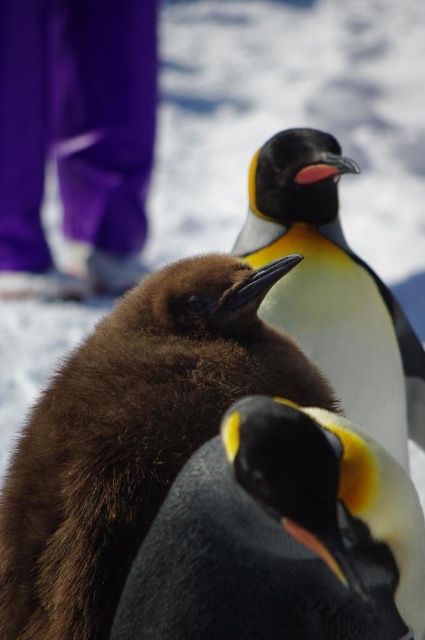
What do you see at coordinates (282, 538) in the screenshot?
I see `black matte penguin at center` at bounding box center [282, 538].

Which is more to the left, black matte penguin at center or black and white feathers at center?

From the viewer's perspective, black matte penguin at center appears more on the left side.

Who is more forward, (x=277, y=506) or (x=334, y=225)?

Point (x=277, y=506) is more forward.

What are the coordinates of `black matte penguin at center` in the screenshot? It's located at (282, 538).

Which is more to the left, brown fuzzy penguin at center or black matte penguin at center?

Positioned to the left is brown fuzzy penguin at center.

Find the location of a particular element. The height and width of the screenshot is (640, 425). brown fuzzy penguin at center is located at coordinates (132, 435).

From the picture: Measure the distance between point (104, 433) and camera.

4.79 feet

Identify the location of brown fuzzy penguin at center. The height and width of the screenshot is (640, 425). (132, 435).

Does brown fuzzy penguin at center have a greater height compared to black and white feathers at center?

No, brown fuzzy penguin at center is not taller than black and white feathers at center.

What do you see at coordinates (132, 435) in the screenshot? The height and width of the screenshot is (640, 425). I see `brown fuzzy penguin at center` at bounding box center [132, 435].

Identify the location of brown fuzzy penguin at center. (132, 435).